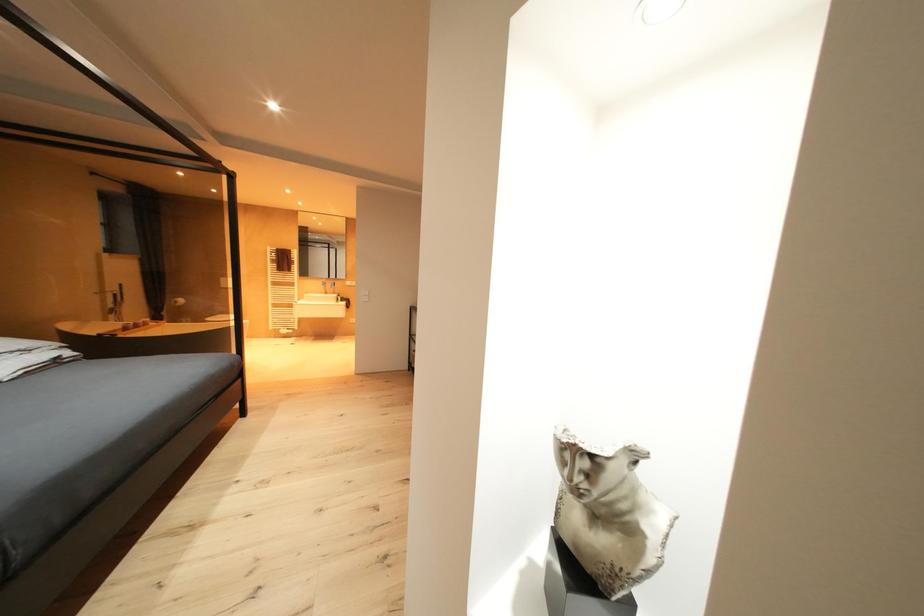
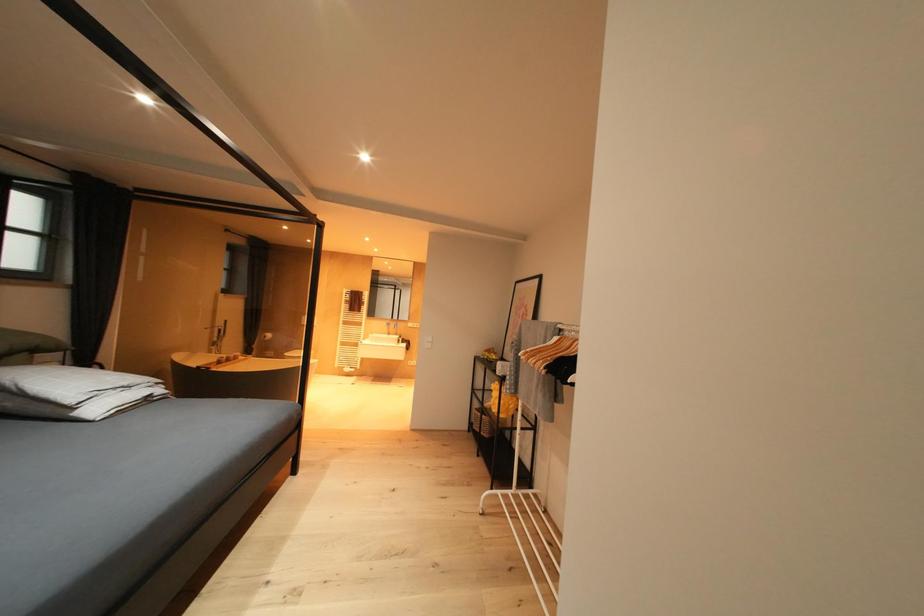
From the picture: Which direction would the cameraman need to move to produce the second image?

The cameraman walked toward left, forward.